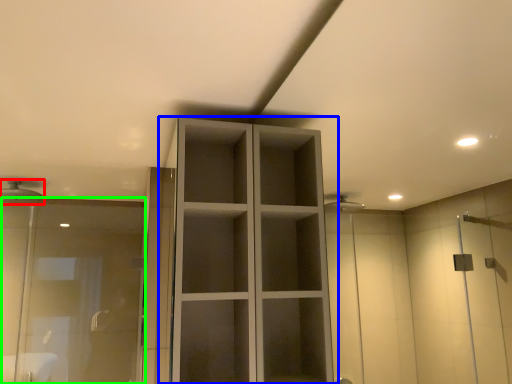
Question: Which object is the farthest from shower (highlighted by a red box)? Choose among these: cupboard (highlighted by a blue box) or screen door (highlighted by a green box).

Choices:
 (A) cupboard
 (B) screen door

Answer: (A)